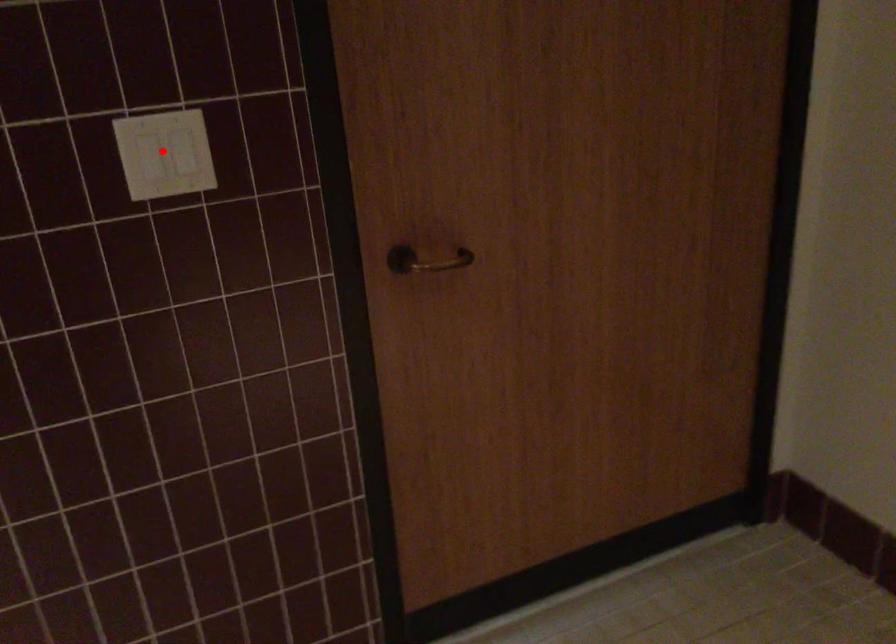
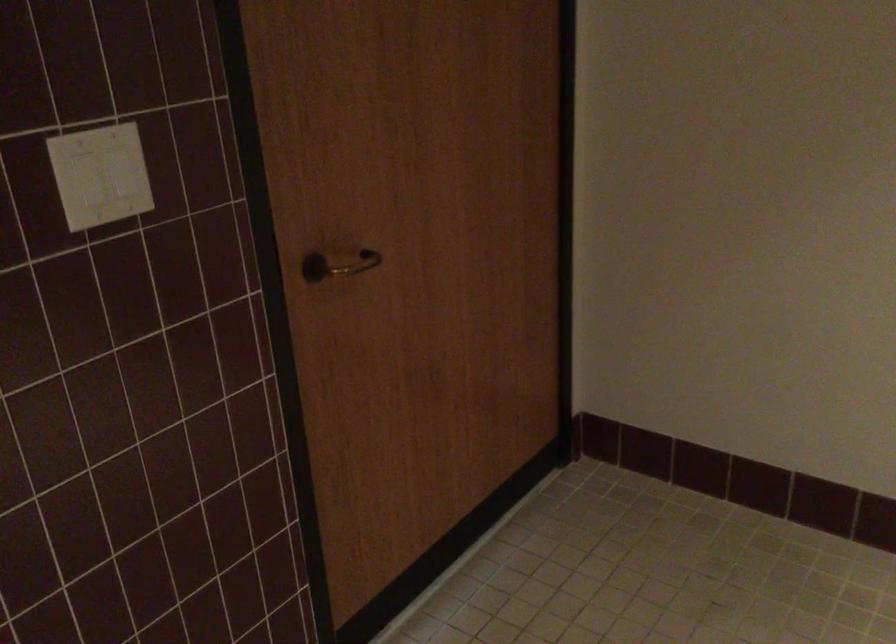
Locate, in the second image, the point that corresponds to the highlighted location in the first image.

(101, 175)